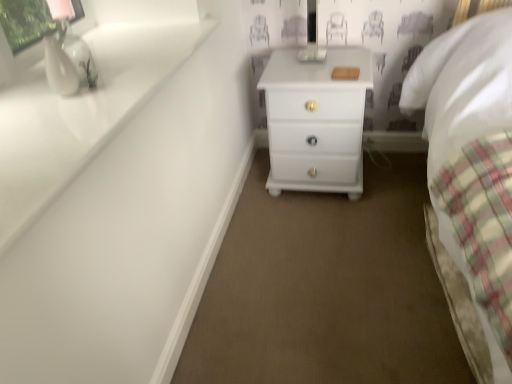
Describe the element at coordinates (59, 68) in the screenshot. I see `white glossy vase at upper left` at that location.

The image size is (512, 384). What do you see at coordinates (316, 121) in the screenshot?
I see `white glossy chest of drawers at center` at bounding box center [316, 121].

The width and height of the screenshot is (512, 384). Find the location of `white glossy sink at upper left`. white glossy sink at upper left is located at coordinates (79, 114).

From a real-world perspective, is white glossy sink at upper left over white glossy vase at upper left?

Actually, white glossy sink at upper left is physically below white glossy vase at upper left in the real world.

From the image's perspective, is white glossy sink at upper left positioned above or below white glossy vase at upper left?

white glossy sink at upper left is below white glossy vase at upper left.

In order to click on vase on the right side of white glossy sink at upper left in this screenshot , I will do `click(59, 68)`.

Is white glossy sink at upper left outside of white glossy vase at upper left?

Indeed, white glossy sink at upper left is completely outside white glossy vase at upper left.

Can we say white glossy vase at upper left lies outside white glossy chest of drawers at center?

white glossy vase at upper left is positioned outside white glossy chest of drawers at center.

Does point (62, 57) lie in front of point (334, 85)?

Yes, it is.

From a real-world perspective, is white glossy vase at upper left positioned over white glossy chest of drawers at center based on gravity?

Yes, from a real-world perspective, white glossy vase at upper left is above white glossy chest of drawers at center.

Considering the relative sizes of white glossy vase at upper left and white glossy chest of drawers at center in the image provided, is white glossy vase at upper left bigger than white glossy chest of drawers at center?

No, white glossy vase at upper left is not bigger than white glossy chest of drawers at center.

Is white glossy vase at upper left positioned far away from white glossy sink at upper left?

They are positioned close to each other.

Is white glossy vase at upper left oriented away from white glossy sink at upper left?

No, white glossy vase at upper left's orientation is not away from white glossy sink at upper left.

Consider the image. From the image's perspective, is white glossy vase at upper left located beneath white glossy sink at upper left?

Incorrect, from the image's perspective, white glossy vase at upper left is higher than white glossy sink at upper left.

Is the depth of white glossy chest of drawers at center greater than that of white glossy sink at upper left?

Yes, white glossy chest of drawers at center is further from the viewer.

From a real-world perspective, which object rests below the other?

white glossy chest of drawers at center, from a real-world perspective.

Considering the relative positions of white glossy chest of drawers at center and white glossy sink at upper left in the image provided, is white glossy chest of drawers at center to the right of white glossy sink at upper left from the viewer's perspective?

Yes.

In terms of size, does white glossy chest of drawers at center appear bigger or smaller than white glossy sink at upper left?

Considering their sizes, white glossy chest of drawers at center takes up more space than white glossy sink at upper left.

From the image's perspective, is white glossy chest of drawers at center below white glossy vase at upper left?

No, from the image's perspective, white glossy chest of drawers at center is not beneath white glossy vase at upper left.

Which is in front, white glossy chest of drawers at center or white glossy vase at upper left?

Positioned in front is white glossy vase at upper left.

Does white glossy chest of drawers at center touch white glossy vase at upper left?

There is a gap between white glossy chest of drawers at center and white glossy vase at upper left.

Consider the image. From the image's perspective, which one is positioned higher, white glossy sink at upper left or white glossy chest of drawers at center?

From the image's view, white glossy chest of drawers at center is above.

Is white glossy sink at upper left looking in the opposite direction of white glossy chest of drawers at center?

No, white glossy sink at upper left is not facing the opposite direction of white glossy chest of drawers at center.

Considering the positions of objects white glossy sink at upper left and white glossy chest of drawers at center in the image provided, who is more to the right, white glossy sink at upper left or white glossy chest of drawers at center?

From the viewer's perspective, white glossy chest of drawers at center appears more on the right side.

What's the angular difference between white glossy sink at upper left and white glossy chest of drawers at center's facing directions?

The facing directions of white glossy sink at upper left and white glossy chest of drawers at center are 89.7 degrees apart.

There is a white glossy sink at upper left. Find the location of `vase above it (from a real-world perspective)`. vase above it (from a real-world perspective) is located at coordinates (59, 68).

Locate an element on the screen. vase in front of the white glossy chest of drawers at center is located at coordinates (59, 68).

Considering their positions, is white glossy sink at upper left positioned closer to white glossy chest of drawers at center than white glossy vase at upper left?

Based on the image, white glossy sink at upper left appears to be nearer to white glossy chest of drawers at center.

Based on their spatial positions, is white glossy chest of drawers at center or white glossy vase at upper left closer to white glossy sink at upper left?

white glossy vase at upper left is positioned closer to the anchor white glossy sink at upper left.

Looking at the image, which one is located further to white glossy vase at upper left, white glossy sink at upper left or white glossy chest of drawers at center?

white glossy chest of drawers at center.

From the picture: Based on their spatial positions, is white glossy vase at upper left or white glossy sink at upper left closer to white glossy chest of drawers at center?

white glossy sink at upper left is closer to white glossy chest of drawers at center.

Which object lies nearer to the anchor point white glossy sink at upper left, white glossy vase at upper left or white glossy chest of drawers at center?

white glossy vase at upper left.

When comparing their distances from white glossy vase at upper left, does white glossy chest of drawers at center or white glossy sink at upper left seem closer?

white glossy sink at upper left lies closer to white glossy vase at upper left than the other object.

The height and width of the screenshot is (384, 512). Find the location of `vase between white glossy sink at upper left and white glossy chest of drawers at center along the z-axis`. vase between white glossy sink at upper left and white glossy chest of drawers at center along the z-axis is located at coordinates (59, 68).